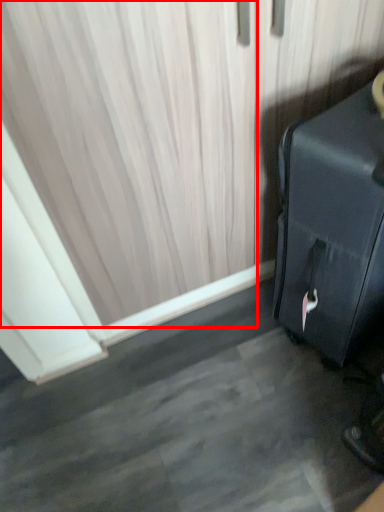
Question: From the image's perspective, what is the correct spatial relationship of curtain (annotated by the red box) in relation to suitcase?

Choices:
 (A) above
 (B) below

Answer: (A)